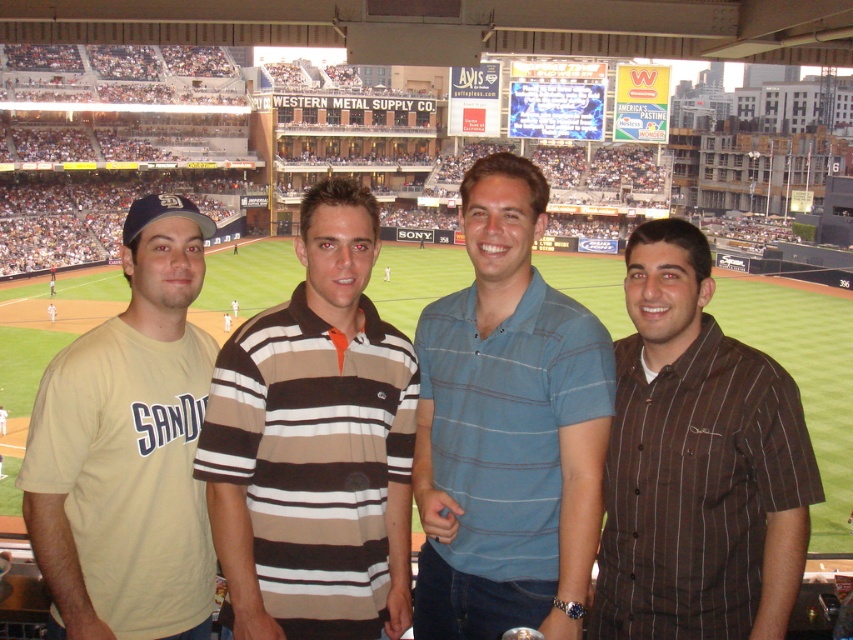
Looking at this image, you are a photographer standing at the origin of the coordinate system in the baseball stadium. You want to take a photo of both the point at (244, 440) and the point at (492, 572). Which point should you focus on first to ensure both are in the frame?

You should focus on the point at (244, 440) first because it is in front of the point at (492, 572), allowing both to be captured in the photo.